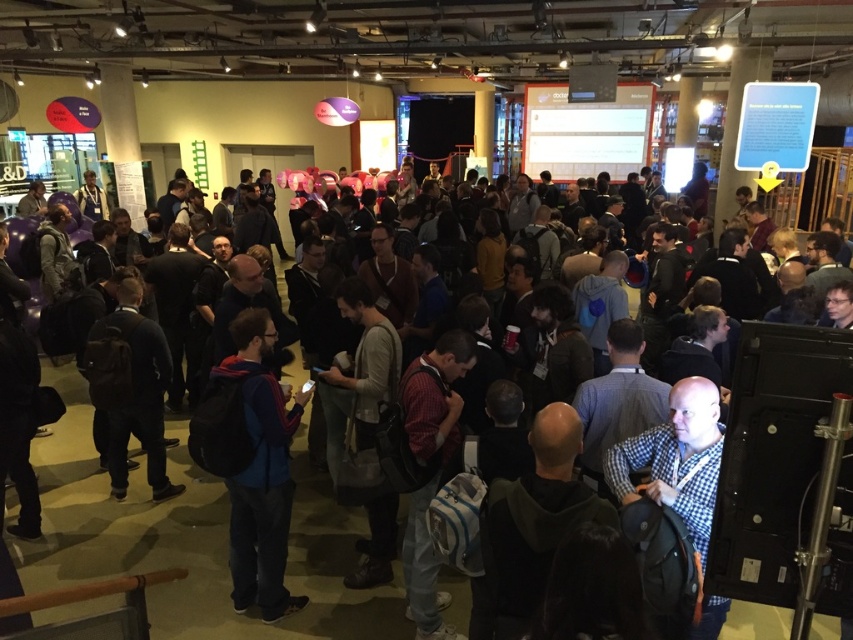
Does dark blue backpack at center have a larger size compared to blue fleece jacket at center?

Indeed, dark blue backpack at center has a larger size compared to blue fleece jacket at center.

Does dark blue backpack at center appear on the right side of blue fleece jacket at center?

In fact, dark blue backpack at center is to the left of blue fleece jacket at center.

Locate an element on the screen. dark blue backpack at center is located at coordinates (190, 538).

At what (x,y) coordinates should I click in order to perform the action: click on dark blue backpack at center. Please return your answer as a coordinate pair (x, y). Looking at the image, I should click on (190, 538).

Is point (221, 632) farther from viewer compared to point (705, 609)?

Yes, point (221, 632) is farther from viewer.

Between point (759, 609) and point (705, 481), which one is positioned in front?

Point (705, 481) is in front.

Locate an element on the screen. The image size is (853, 640). dark blue backpack at center is located at coordinates (190, 538).

Is point (247, 497) more distant than point (653, 470)?

That is True.

Identify the location of blue fleece jacket at center. The width and height of the screenshot is (853, 640). (251, 461).